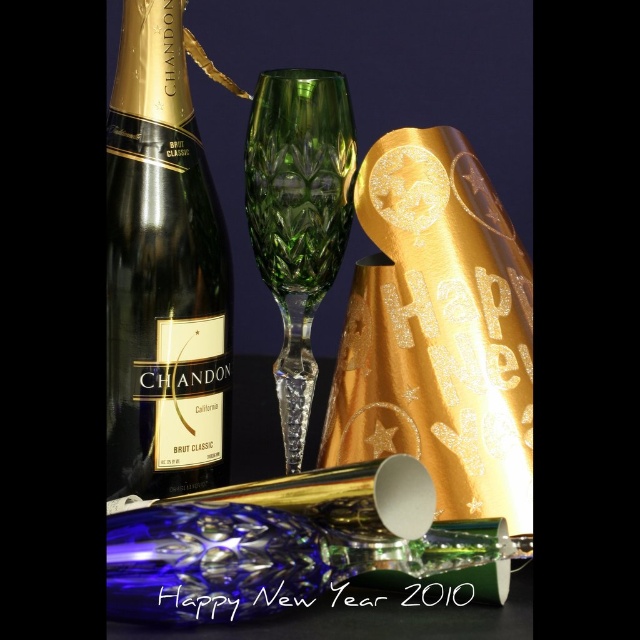
Does matte gold bottle at left have a lesser width compared to green crystal flute at center?

In fact, matte gold bottle at left might be wider than green crystal flute at center.

Does matte gold bottle at left appear on the right side of green crystal flute at center?

In fact, matte gold bottle at left is to the left of green crystal flute at center.

Which is in front, point (184, 282) or point (342, 113)?

Point (342, 113) is more forward.

At what (x,y) coordinates should I click in order to perform the action: click on matte gold bottle at left. Please return your answer as a coordinate pair (x, y). Image resolution: width=640 pixels, height=640 pixels. Looking at the image, I should click on (163, 273).